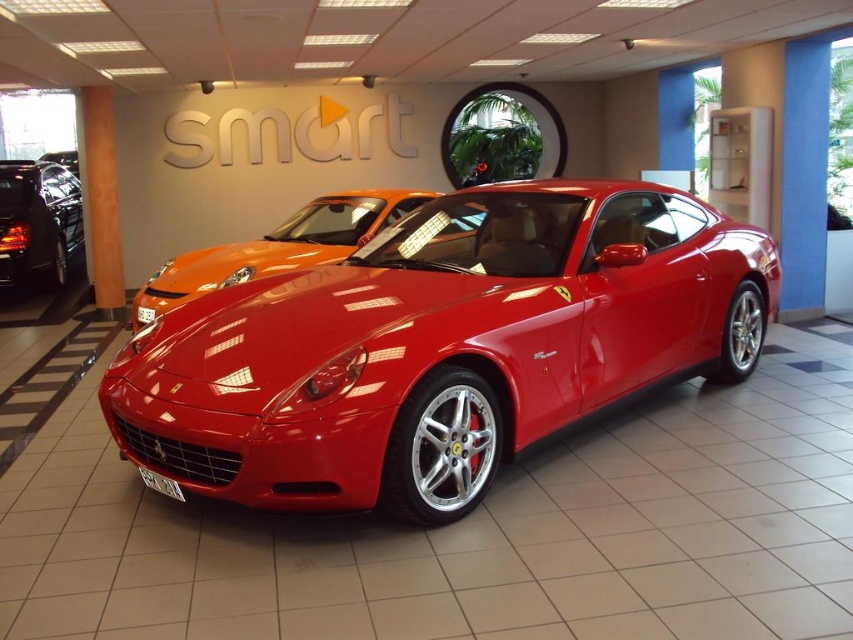
Question: Does shiny red car at center have a smaller size compared to metallic orange car at upper center?

Choices:
 (A) yes
 (B) no

Answer: (B)

Question: Estimate the real-world distances between objects in this image. Which object is farther from the glossy black car at left?

Choices:
 (A) metallic orange car at upper center
 (B) shiny red sports car at center
 (C) shiny red car at center

Answer: (B)

Question: Is shiny red car at center bigger than glossy black car at left?

Choices:
 (A) yes
 (B) no

Answer: (B)

Question: Is shiny red car at center positioned at the back of glossy black car at left?

Choices:
 (A) yes
 (B) no

Answer: (B)

Question: Which object is the farthest from the glossy black car at left?

Choices:
 (A) shiny red sports car at center
 (B) metallic orange car at upper center
 (C) shiny red car at center

Answer: (A)

Question: Which point is farther to the camera?

Choices:
 (A) (305, 468)
 (B) (287, 241)
 (C) (73, 164)

Answer: (C)